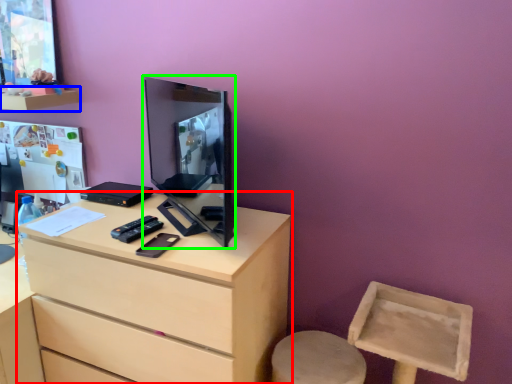
Question: Which object is the farthest from chest of drawers (highlighted by a red box)? Choose among these: shelf (highlighted by a blue box) or computer monitor (highlighted by a green box).

Choices:
 (A) shelf
 (B) computer monitor

Answer: (A)